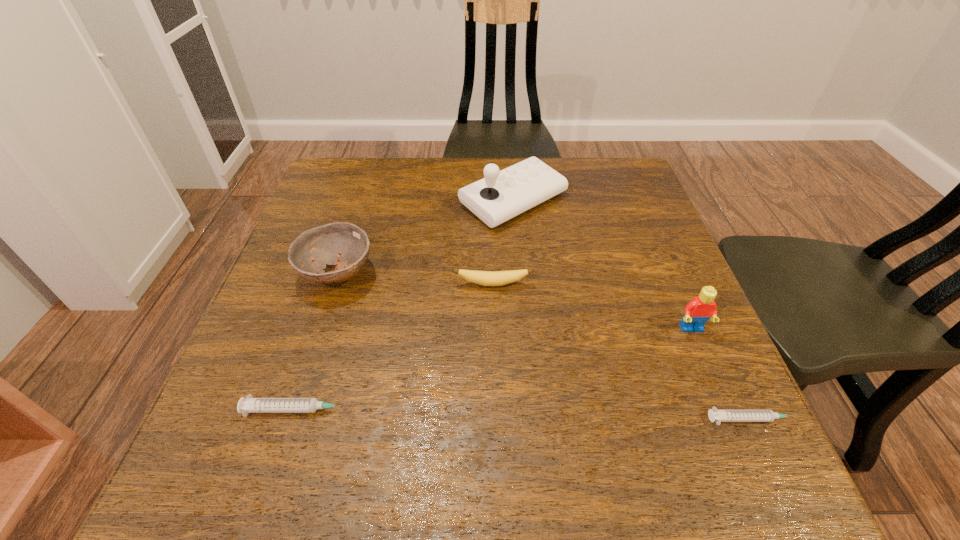
Locate an element on the screen. This screenshot has width=960, height=540. object identified as the closest to the tallest object is located at coordinates (486, 278).